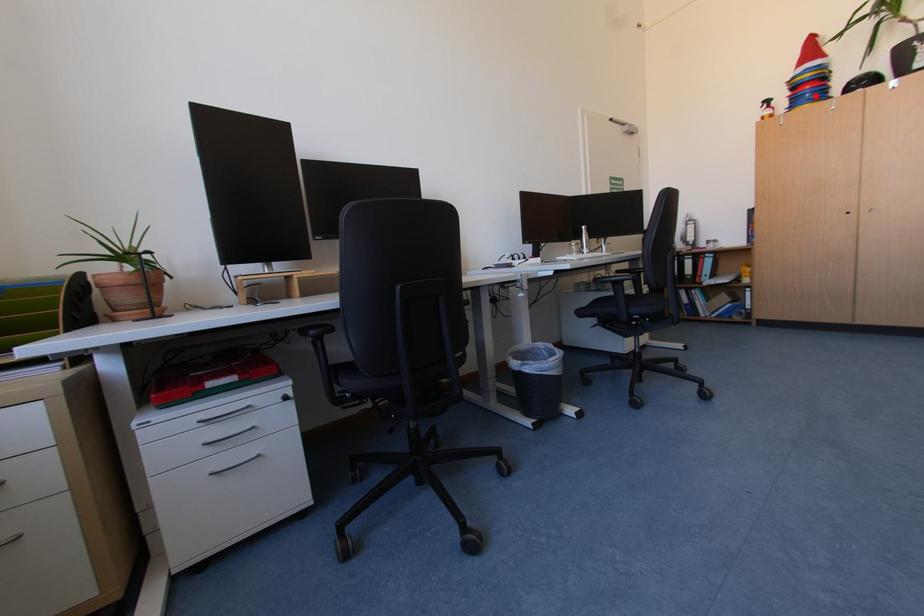
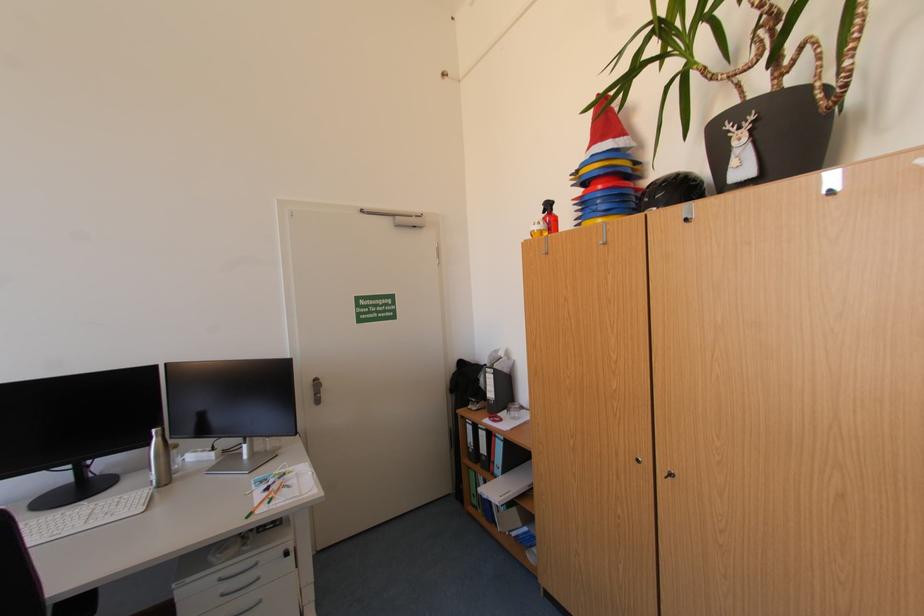
The point at the highlighted location is marked in the first image. Where is the corresponding point in the second image?

(606, 203)